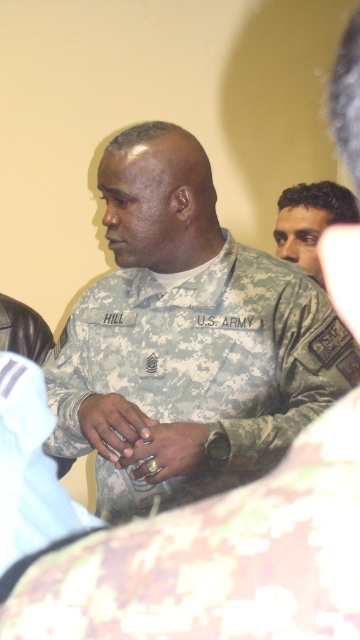
Question: Is camouflage fabric us army uniform at center to the right of matte camouflage ring at center from the viewer's perspective?

Choices:
 (A) yes
 (B) no

Answer: (A)

Question: Which object is closer to the camera taking this photo?

Choices:
 (A) matte camouflage ring at center
 (B) dark brown hair at upper right

Answer: (A)

Question: From the image, what is the correct spatial relationship of camouflage fabric us army uniform at center in relation to dark brown hair at upper right?

Choices:
 (A) right
 (B) left

Answer: (B)

Question: Is camouflage fabric us army uniform at center below dark brown hair at upper right?

Choices:
 (A) yes
 (B) no

Answer: (A)

Question: Among these points, which one is farthest from the camera?

Choices:
 (A) (348, 209)
 (B) (123, 397)
 (C) (165, 445)
 (D) (311, 289)

Answer: (A)

Question: Which object is the farthest from the gold metallic ring at center?

Choices:
 (A) camouflage fabric us army uniform at center
 (B) matte camouflage ring at center
 (C) dark brown hair at upper right

Answer: (C)